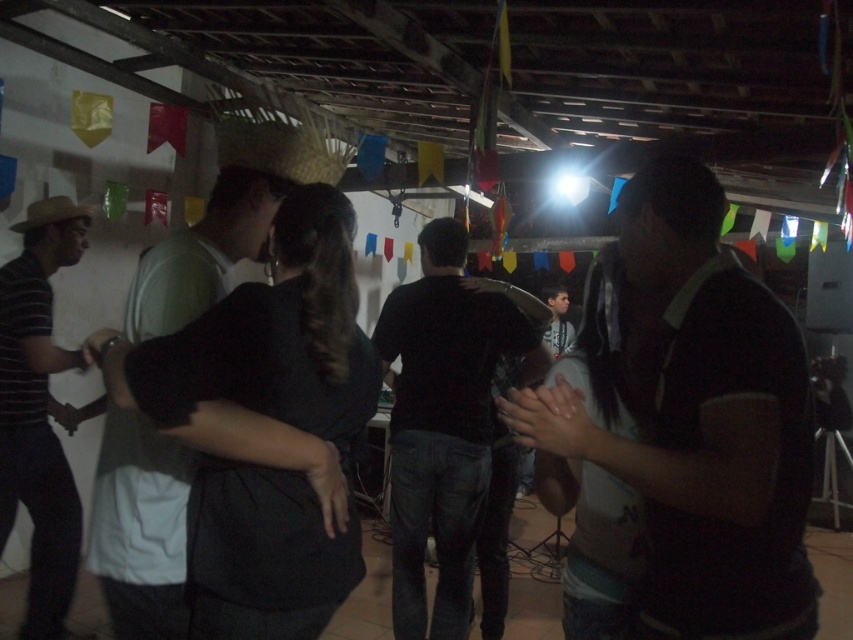
Consider the image. Does dark brown shirt at center have a lesser height compared to striped cotton shirt at left?

Indeed, dark brown shirt at center has a lesser height compared to striped cotton shirt at left.

Can you confirm if dark brown shirt at center is positioned to the right of striped cotton shirt at left?

Indeed, dark brown shirt at center is positioned on the right side of striped cotton shirt at left.

Where is `dark brown shirt at center`? The width and height of the screenshot is (853, 640). dark brown shirt at center is located at coordinates (699, 420).

Does dark green shirt at center have a lesser height compared to straw hat at center?

In fact, dark green shirt at center may be taller than straw hat at center.

Does dark green shirt at center appear under straw hat at center?

Indeed, dark green shirt at center is positioned under straw hat at center.

Between point (149, 333) and point (45, 211), which one is positioned in front?

Point (149, 333)

I want to click on dark green shirt at center, so click(140, 528).

Is dark brown shirt at center thinner than straw hat at center?

Incorrect, dark brown shirt at center's width is not less than straw hat at center's.

The image size is (853, 640). In order to click on dark brown shirt at center in this screenshot , I will do `click(699, 420)`.